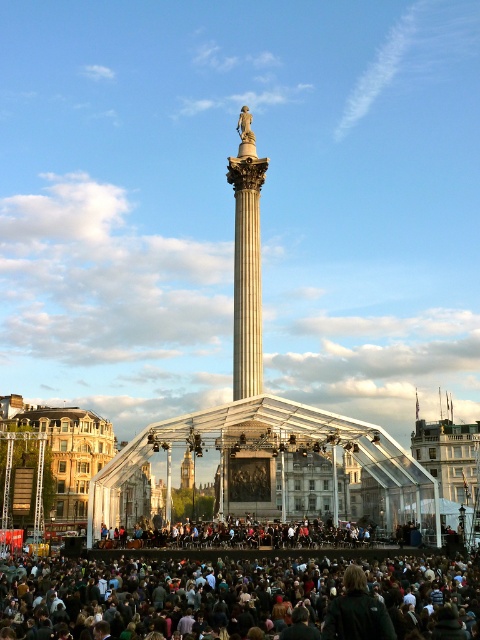
Question: Can you confirm if polished stone column at center is positioned below white marble column at center?

Choices:
 (A) yes
 (B) no

Answer: (A)

Question: Among these points, which one is nearest to the camera?

Choices:
 (A) (250, 220)
 (B) (259, 336)

Answer: (B)

Question: Which point appears farthest from the camera in this image?

Choices:
 (A) (247, 106)
 (B) (247, 138)
 (C) (75, 588)

Answer: (A)

Question: Is white marble column at center positioned behind bronze statue at center?

Choices:
 (A) no
 (B) yes

Answer: (A)

Question: Which point is closer to the camera?

Choices:
 (A) white marble column at center
 (B) polished stone column at center

Answer: (B)

Question: Is polished stone column at center wider than white marble column at center?

Choices:
 (A) no
 (B) yes

Answer: (B)